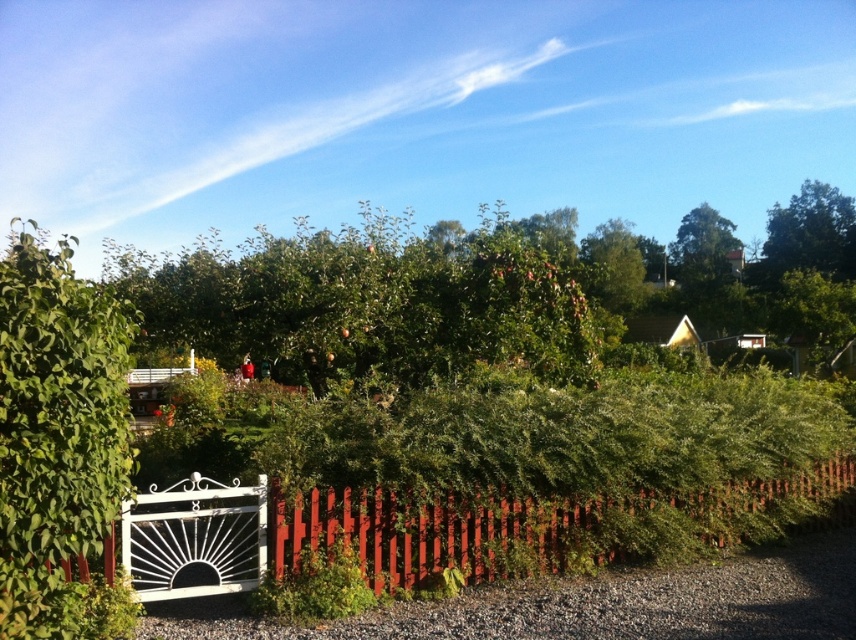
You are standing at the entrance of the garden and see the green leafy bush at center. If you want to walk towards it, which direction should you move relative to your current position?

The green leafy bush at center is located at point coordinates, so you should move forward and slightly to the right to reach it.

You are standing in the garden and want to locate the red wooden fence at lower center. According to the coordinates provided, where would you find it?

The red wooden fence at lower center is located at the 2D coordinates point [535,524].

You are standing in the garden scene looking at two points marked in the image. Which point, point [418,564] or point [849,209], is closer to you?

Point [418,564] is closer to the viewer than point [849,209].